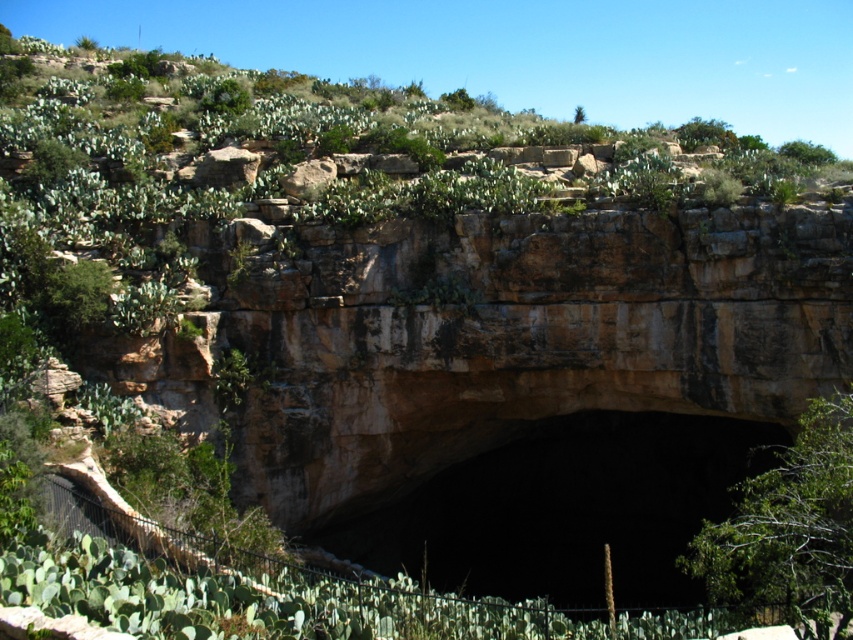
Question: Which of the following is the closest to the observer?

Choices:
 (A) (788, 595)
 (B) (593, 426)

Answer: (A)

Question: Does dark brown stone cave at center appear on the right side of green leafy bush at center?

Choices:
 (A) yes
 (B) no

Answer: (B)

Question: Is dark brown stone cave at center smaller than green leafy bush at center?

Choices:
 (A) yes
 (B) no

Answer: (A)

Question: Does dark brown stone cave at center have a lesser width compared to green leafy bush at center?

Choices:
 (A) yes
 (B) no

Answer: (B)

Question: Which of the following is the closest to the observer?

Choices:
 (A) (467, 532)
 (B) (848, 556)

Answer: (B)